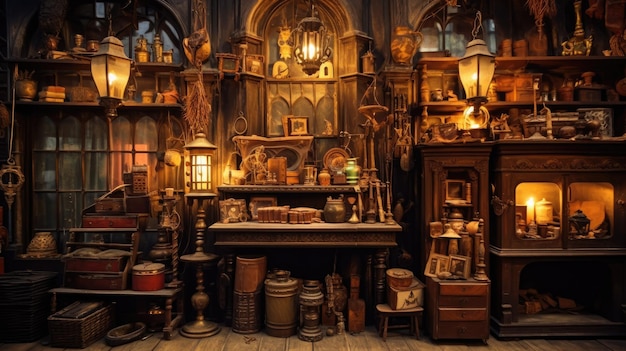
Image resolution: width=626 pixels, height=351 pixels. In order to click on candles in this screenshot , I will do pyautogui.click(x=434, y=229), pyautogui.click(x=449, y=224), pyautogui.click(x=461, y=224), pyautogui.click(x=539, y=209).